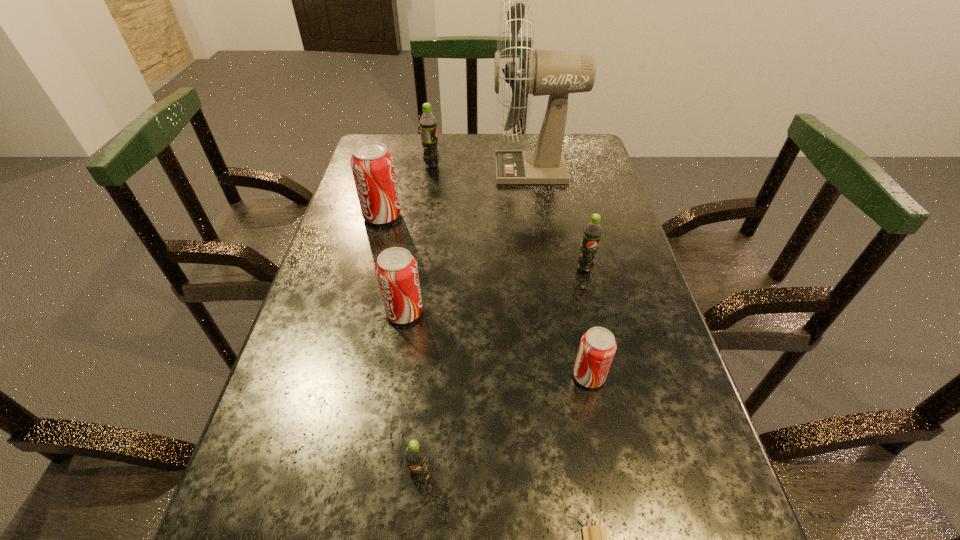
The height and width of the screenshot is (540, 960). In the image, there is a desktop. In order to click on vacant area at the far edge in this screenshot , I will do `click(537, 140)`.

You are a GUI agent. You are given a task and a screenshot of the screen. Output one action in this format:
    pyautogui.click(x=<x>, y=<y>)
    Task: Click on the vacant area at the left edge of the desktop
    
    Given the screenshot: What is the action you would take?
    pyautogui.click(x=325, y=251)

Image resolution: width=960 pixels, height=540 pixels. Identify the location of free location at the right edge. (692, 401).

Where is `free space that is in between the fifth nearest object and the third nearest soda`? free space that is in between the fifth nearest object and the third nearest soda is located at coordinates (494, 291).

What are the coordinates of `vacant space in between the biggest green soda and the fourth farthest object` in the screenshot? It's located at (508, 217).

Find the location of a particular element. This screenshot has height=540, width=960. vacant space that is in between the biggest green soda and the sixth nearest object is located at coordinates (407, 191).

You are a GUI agent. You are given a task and a screenshot of the screen. Output one action in this format:
    pyautogui.click(x=<x>, y=<y>)
    Task: Click on the free point between the second green soda from left to right and the leftmost object
    Image resolution: width=960 pixels, height=540 pixels.
    Given the screenshot: What is the action you would take?
    pyautogui.click(x=401, y=346)

Locate an element on the screen. This screenshot has height=540, width=960. free area in between the gray fan and the farthest soda is located at coordinates (483, 168).

Locate an element on the screen. The height and width of the screenshot is (540, 960). vacant point located between the biggest red soda can and the second green soda from right to left is located at coordinates (401, 346).

This screenshot has height=540, width=960. I want to click on vacant point located between the second biggest green soda and the second green soda from right to left, so click(503, 373).